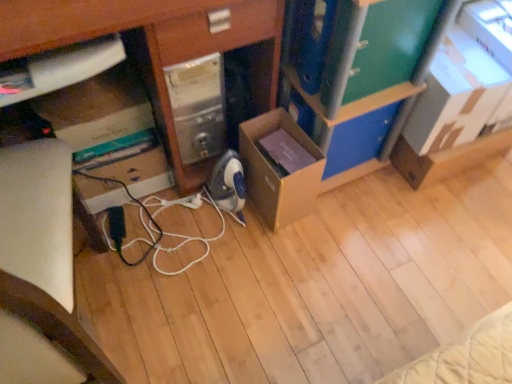
Question: From a real-world perspective, is blue plastic drawer at center, the first drawer from the back, beneath black rubber cable at center?

Choices:
 (A) no
 (B) yes

Answer: (A)

Question: Are blue plastic drawer at center, the second drawer from the front, and black rubber cable at center making contact?

Choices:
 (A) yes
 (B) no

Answer: (B)

Question: Considering the relative sizes of blue plastic drawer at center, which ranks as the second drawer in top-to-bottom order, and black rubber cable at center in the image provided, is blue plastic drawer at center, which ranks as the second drawer in top-to-bottom order, smaller than black rubber cable at center?

Choices:
 (A) no
 (B) yes

Answer: (B)

Question: Can you confirm if blue plastic drawer at center, the second drawer from the front, is wider than black rubber cable at center?

Choices:
 (A) yes
 (B) no

Answer: (B)

Question: Is black rubber cable at center completely or partially inside blue plastic drawer at center, which is the 1th drawer in bottom-to-top order?

Choices:
 (A) yes
 (B) no

Answer: (B)

Question: From a real-world perspective, is brown cardboard box at center, positioned as the second cardboard box in right-to-left order, physically located above or below matte cardboard box at lower left?

Choices:
 (A) below
 (B) above

Answer: (A)

Question: Considering the positions of brown cardboard box at center, the 1th cardboard box viewed from the left, and matte cardboard box at lower left in the image, is brown cardboard box at center, the 1th cardboard box viewed from the left, wider or thinner than matte cardboard box at lower left?

Choices:
 (A) wide
 (B) thin

Answer: (B)

Question: Looking at the image, does brown cardboard box at center, the 1th cardboard box viewed from the left, seem bigger or smaller compared to matte cardboard box at lower left?

Choices:
 (A) big
 (B) small

Answer: (B)

Question: From their relative heights in the image, would you say brown cardboard box at center, positioned as the second cardboard box in right-to-left order, is taller or shorter than matte cardboard box at lower left?

Choices:
 (A) tall
 (B) short

Answer: (B)

Question: In terms of width, does cardboard box at upper right, the first cardboard box from the right, look wider or thinner when compared to green matte drawer at upper right, the 1th drawer viewed from the top?

Choices:
 (A) thin
 (B) wide

Answer: (B)

Question: Considering the positions of cardboard box at upper right, which appears as the second cardboard box when viewed from the left, and green matte drawer at upper right, the 2th drawer when ordered from bottom to top, in the image, is cardboard box at upper right, which appears as the second cardboard box when viewed from the left, taller or shorter than green matte drawer at upper right, the 2th drawer when ordered from bottom to top,?

Choices:
 (A) short
 (B) tall

Answer: (B)

Question: Is cardboard box at upper right, which appears as the second cardboard box when viewed from the left, bigger or smaller than green matte drawer at upper right, arranged as the second drawer when viewed from the back?

Choices:
 (A) big
 (B) small

Answer: (A)

Question: In the image, is cardboard box at upper right, which appears as the second cardboard box when viewed from the left, positioned in front of or behind green matte drawer at upper right, arranged as the second drawer when viewed from the back?

Choices:
 (A) behind
 (B) front

Answer: (A)

Question: Is blue plastic drawer at center, the second drawer from the front, inside or outside of green matte bookshelf at upper right?

Choices:
 (A) inside
 (B) outside

Answer: (A)

Question: From the image's perspective, is blue plastic drawer at center, which ranks as the second drawer in top-to-bottom order, positioned above or below green matte bookshelf at upper right?

Choices:
 (A) above
 (B) below

Answer: (B)